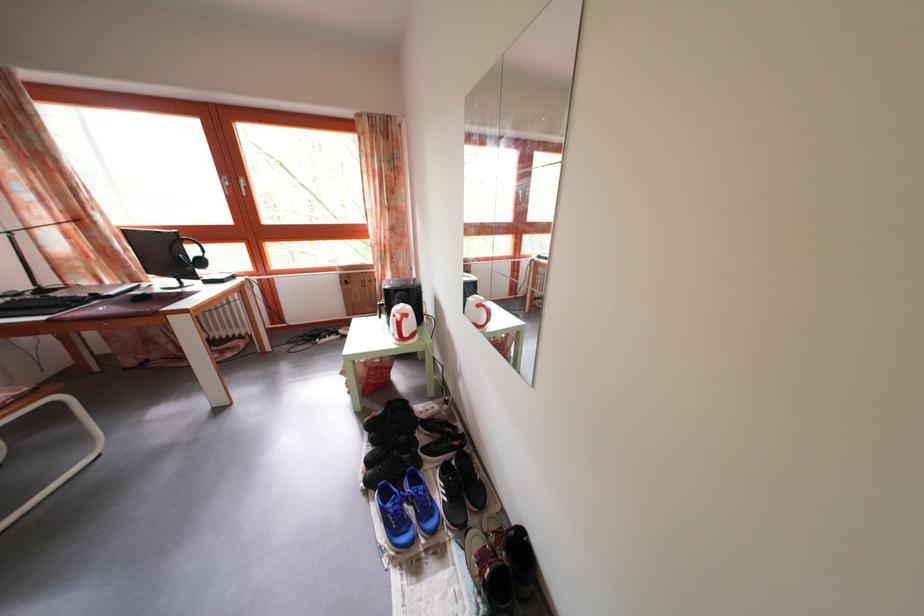
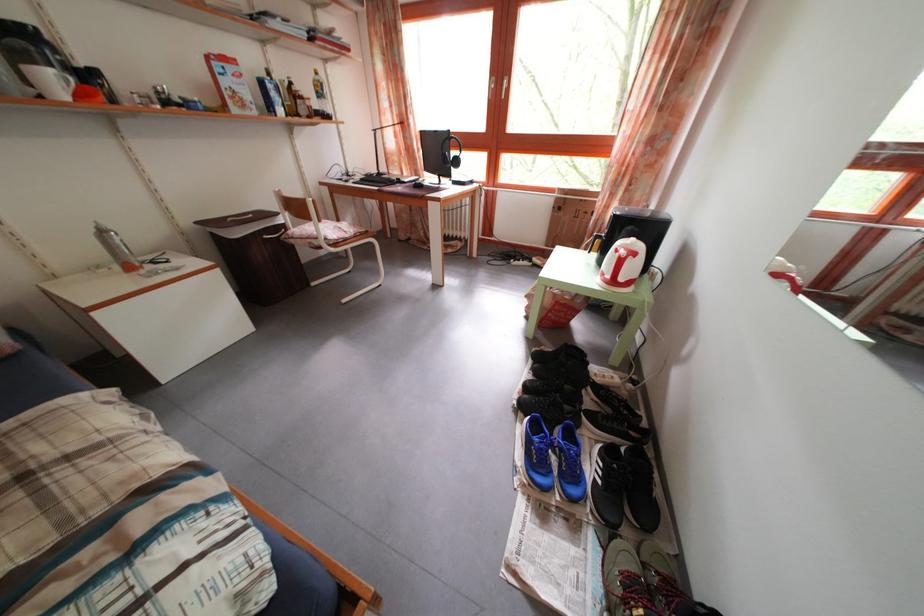
In the second image, find the point that corresponds to pixel 414 323 in the first image.

(641, 262)